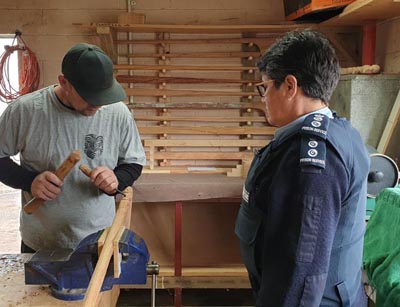
Find the location of a particular element. cable is located at coordinates (31, 75).